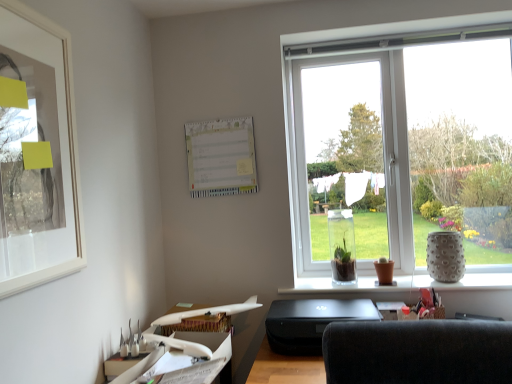
Question: From the image's perspective, is speckled ceramic vase at right beneath white paper calendar at upper center?

Choices:
 (A) yes
 (B) no

Answer: (A)

Question: Is speckled ceramic vase at right oriented towards white paper calendar at upper center?

Choices:
 (A) no
 (B) yes

Answer: (A)

Question: Can we say speckled ceramic vase at right lies outside white paper calendar at upper center?

Choices:
 (A) yes
 (B) no

Answer: (A)

Question: Would you say speckled ceramic vase at right contains white paper calendar at upper center?

Choices:
 (A) no
 (B) yes

Answer: (A)

Question: Can you confirm if speckled ceramic vase at right is thinner than white paper calendar at upper center?

Choices:
 (A) yes
 (B) no

Answer: (B)

Question: Is speckled ceramic vase at right further to camera compared to white paper calendar at upper center?

Choices:
 (A) yes
 (B) no

Answer: (B)

Question: Considering the relative sizes of clear glass vase at center and white matte picture frame at upper left in the image provided, is clear glass vase at center bigger than white matte picture frame at upper left?

Choices:
 (A) no
 (B) yes

Answer: (B)

Question: Can you confirm if clear glass vase at center is smaller than white matte picture frame at upper left?

Choices:
 (A) yes
 (B) no

Answer: (B)

Question: Considering the relative positions of clear glass vase at center and white matte picture frame at upper left in the image provided, is clear glass vase at center to the left of white matte picture frame at upper left from the viewer's perspective?

Choices:
 (A) yes
 (B) no

Answer: (B)

Question: Considering the relative sizes of clear glass vase at center and white matte picture frame at upper left in the image provided, is clear glass vase at center wider than white matte picture frame at upper left?

Choices:
 (A) no
 (B) yes

Answer: (B)

Question: Is clear glass vase at center further to the viewer compared to white matte picture frame at upper left?

Choices:
 (A) yes
 (B) no

Answer: (A)

Question: From the image's perspective, would you say clear glass vase at center is positioned over white matte picture frame at upper left?

Choices:
 (A) no
 (B) yes

Answer: (A)

Question: From a real-world perspective, is white plastic airplane at lower left over speckled ceramic vase at right?

Choices:
 (A) yes
 (B) no

Answer: (B)